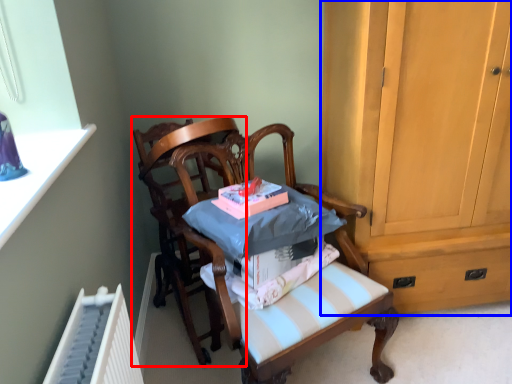
Question: Which point is further to the camera, chair (highlighted by a red box) or cabinetry (highlighted by a blue box)?

Choices:
 (A) chair
 (B) cabinetry

Answer: (A)